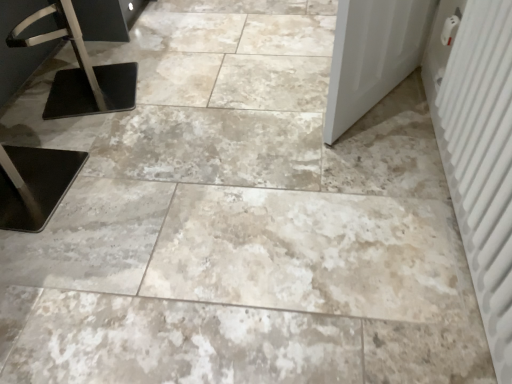
Where is `white textured radiator at right`? white textured radiator at right is located at coordinates (479, 153).

What is the approximate height of white textured radiator at right?

It is 20.77 inches.

Describe the element at coordinates (479, 153) in the screenshot. Image resolution: width=512 pixels, height=384 pixels. I see `white textured radiator at right` at that location.

What are the coordinates of `white textured radiator at right` in the screenshot? It's located at (479, 153).